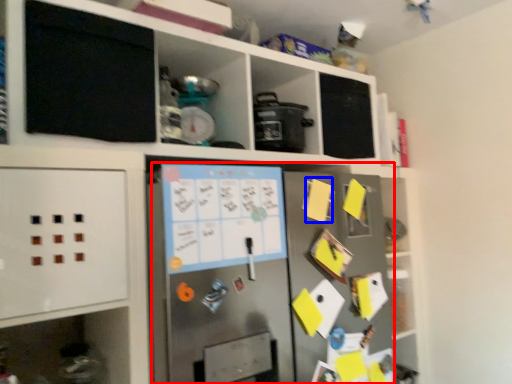
Question: Which object appears closest to the camera in this image, fridge (highlighted by a red box) or note (highlighted by a blue box)?

Choices:
 (A) fridge
 (B) note

Answer: (A)